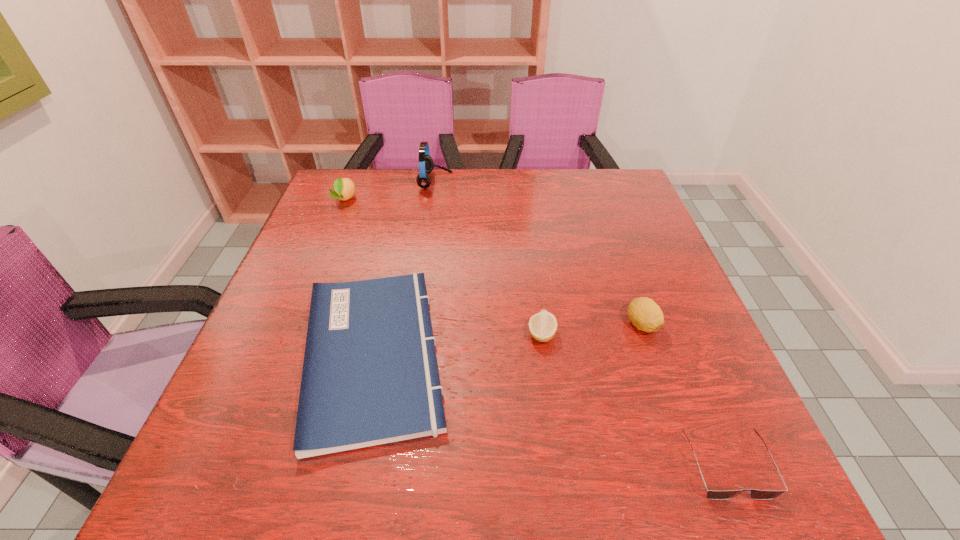
Where is `the tallest object`? Image resolution: width=960 pixels, height=540 pixels. the tallest object is located at coordinates (426, 164).

At what (x,y) coordinates should I click in order to perform the action: click on the leftmost lemon. Please return your answer as a coordinate pair (x, y). The width and height of the screenshot is (960, 540). Looking at the image, I should click on (344, 188).

Find the location of a particular element. The image size is (960, 540). the rightmost lemon is located at coordinates (644, 313).

Find the location of a particular element. paperback book is located at coordinates (370, 377).

In order to click on the shortest lemon in this screenshot , I will do `click(543, 325)`.

Locate an element on the screen. the second lemon from left to right is located at coordinates (543, 325).

The height and width of the screenshot is (540, 960). In order to click on sunglasses in this screenshot , I will do `click(755, 494)`.

This screenshot has height=540, width=960. I want to click on free region located 0.260m with the microphone attached to the side of the headset, so click(537, 181).

Where is `vacant space located with leaves positioned above the leftmost lemon`? The width and height of the screenshot is (960, 540). vacant space located with leaves positioned above the leftmost lemon is located at coordinates (320, 261).

Where is `vacant space located 0.160m at the stem end of the rightmost lemon`? vacant space located 0.160m at the stem end of the rightmost lemon is located at coordinates (672, 411).